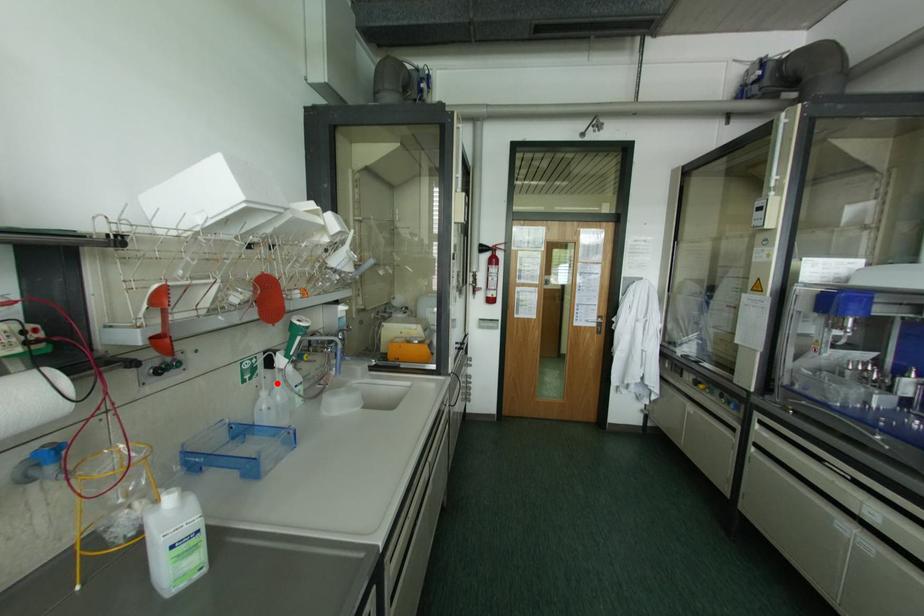
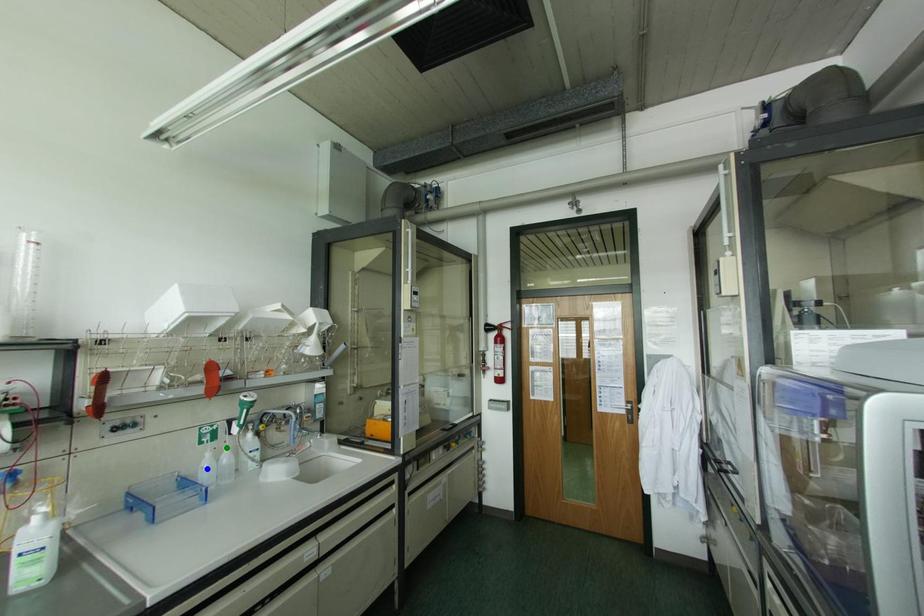
Question: I am providing you with two images of the same scene from different viewpoints. A red point is marked on the first image. You are given multiple points on the second image. Can you choose the point in image 2 that corresponds to the point in image 1?

Choices:
 (A) yellow point
 (B) blue point
 (C) green point

Answer: (C)